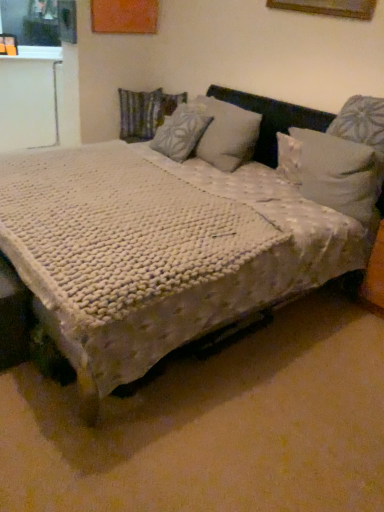
Question: Should I look upward or downward to see white textured blanket at center?

Choices:
 (A) up
 (B) down

Answer: (A)

Question: Is the depth of textured fabric pillow at center, the third pillow in the front-to-back sequence, less than that of white textured blanket at center?

Choices:
 (A) no
 (B) yes

Answer: (A)

Question: Is the depth of textured fabric pillow at center, which is the 1th pillow in back-to-front order, greater than that of white textured blanket at center?

Choices:
 (A) yes
 (B) no

Answer: (A)

Question: Is textured fabric pillow at center, the third pillow in the front-to-back sequence, aimed at white textured blanket at center?

Choices:
 (A) yes
 (B) no

Answer: (A)

Question: Does textured fabric pillow at center, which is the 1th pillow in back-to-front order, have a greater width compared to white textured blanket at center?

Choices:
 (A) yes
 (B) no

Answer: (B)

Question: From a real-world perspective, is textured fabric pillow at center, which is the 1th pillow from left to right, over white textured blanket at center?

Choices:
 (A) no
 (B) yes

Answer: (B)

Question: Is textured fabric pillow at center, which is the 1th pillow in back-to-front order, bigger than white textured blanket at center?

Choices:
 (A) no
 (B) yes

Answer: (A)

Question: Is white textured blanket at center behind white soft pillow at upper right, which ranks as the third pillow in left-to-right order?

Choices:
 (A) yes
 (B) no

Answer: (B)

Question: Considering the relative positions of white textured blanket at center and white soft pillow at upper right, which ranks as the third pillow in left-to-right order, in the image provided, is white textured blanket at center to the right of white soft pillow at upper right, which ranks as the third pillow in left-to-right order, from the viewer's perspective?

Choices:
 (A) yes
 (B) no

Answer: (B)

Question: Is the depth of white textured blanket at center less than that of white soft pillow at upper right, placed as the 1th pillow when sorted from right to left?

Choices:
 (A) yes
 (B) no

Answer: (A)

Question: Is white textured blanket at center bigger than white soft pillow at upper right, which appears as the 1th pillow when viewed from the front?

Choices:
 (A) yes
 (B) no

Answer: (A)

Question: Is there a large distance between white textured blanket at center and white soft pillow at upper right, which ranks as the third pillow in left-to-right order?

Choices:
 (A) yes
 (B) no

Answer: (B)

Question: Can you confirm if white textured blanket at center is positioned to the left of white soft pillow at upper right, placed as the 1th pillow when sorted from right to left?

Choices:
 (A) no
 (B) yes

Answer: (B)

Question: Are white soft pillow at upper right, placed as the 1th pillow when sorted from right to left, and white textured pillow at center, the second pillow viewed from the left, located far from each other?

Choices:
 (A) no
 (B) yes

Answer: (A)